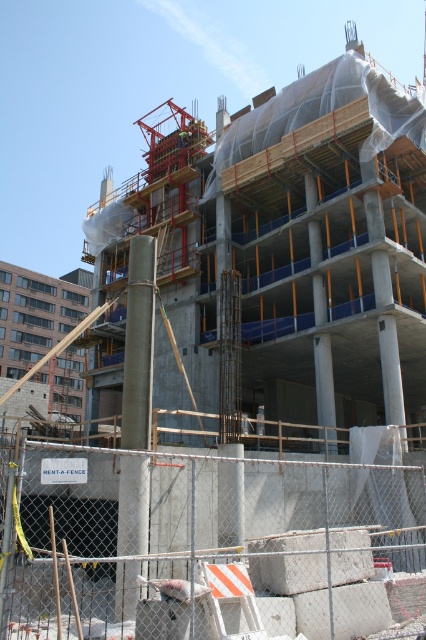
You are a construction worker standing at the base of the building. You notice two points marked on the structure. One is at coordinate point (123, 465) and the other is at point (129, 259). Which point is closer to your current position?

Point (123, 465) is closer to the camera than point (129, 259), so the point at coordinate point (123, 465) is closer to your current position.

Consider the image. You are a construction worker who needs to move a heavy equipment through the gap between the white concrete blocks at lower center and the concrete column at center. Can the equipment pass through the gap if the equipment requires a minimum of 1 meter of space?

The white concrete blocks at lower center are larger in size than the concrete column at center. However, the exact dimensions of the gap are not provided, so it is uncertain if the equipment requiring 1 meter of space can pass through. Additional measurements would be needed to confirm.

You are a construction worker who needs to place a 1.2 meter wide wooden plank between the white concrete blocks at lower center and the concrete column at center. Can the plank fit horizontally between them?

The white concrete blocks at lower center are wider than the concrete column at center. Since the plank is 1.2 meters wide, it depends on the actual width of the blocks and column. However, since the blocks are wider, there might not be enough space for the plank to fit horizontally between them.